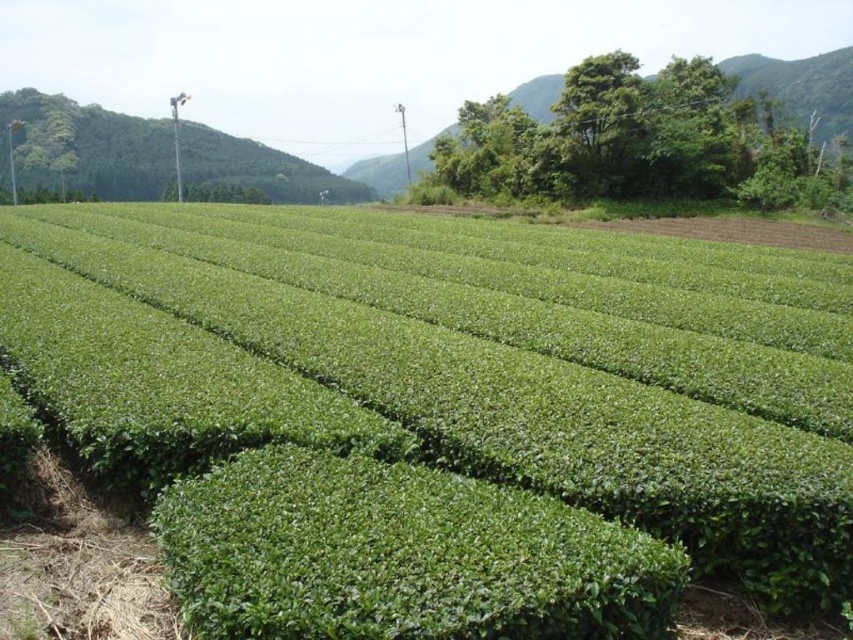
Question: From the image, what is the correct spatial relationship of green leafy field at center in relation to green leafy hillside at upper right?

Choices:
 (A) above
 (B) below

Answer: (B)

Question: Which point appears closest to the camera in this image?

Choices:
 (A) (720, 506)
 (B) (844, 93)

Answer: (A)

Question: Is green leafy field at center further to the viewer compared to green leafy hillside at upper right?

Choices:
 (A) no
 (B) yes

Answer: (A)

Question: Does green leafy field at center appear on the left side of green leafy hillside at upper right?

Choices:
 (A) no
 (B) yes

Answer: (B)